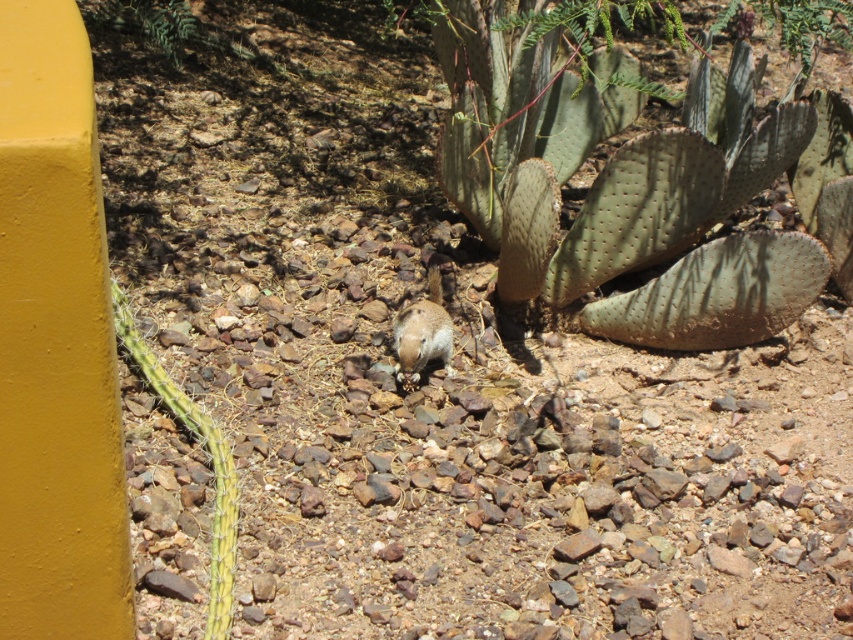
You are a desert explorer and you see a point marked at coordinates (636, 186). What object is this point located on?

The point at coordinates (636, 186) is located on the green spiny cactus at center.

You are a photographer trying to capture the green spiny cactus at center and the brown furry squirrel at center in the same frame. Which object should you focus on first to ensure both are in focus?

The green spiny cactus at center is closer to the viewer than the brown furry squirrel at center, so you should focus on the green spiny cactus at center first to ensure both are in focus.